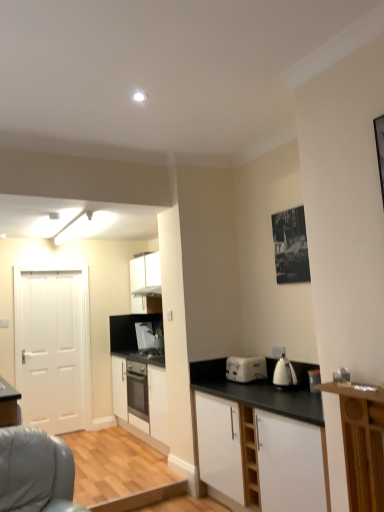
Question: From the image's perspective, relative to white matte cabinet at center, acting as the 3th cabinetry starting from the front, is white glossy electric kettle at right, which appears as the 3th kitchen appliance when viewed from the back, above or below?

Choices:
 (A) below
 (B) above

Answer: (B)

Question: Is white glossy electric kettle at right, positioned as the first kitchen appliance in right-to-left order, taller or shorter than white matte cabinet at center, acting as the 3th cabinetry starting from the front?

Choices:
 (A) tall
 (B) short

Answer: (B)

Question: Based on their relative distances, which object is farther from the matte black microwave at center, the third kitchen appliance when ordered from right to left?

Choices:
 (A) white plastic toaster at center, positioned as the 2th kitchen appliance in right-to-left order
 (B) white plastic toaster at center
 (C) white matte cabinet at center, the 2th cabinetry positioned from the front
 (D) black matte sink at center
 (E) white matte cabinet at lower right, marked as the 1th cabinetry in a front-to-back arrangement

Answer: (B)

Question: Based on their relative distances, which object is farther from the white matte cabinet at center, acting as the 3th cabinetry starting from the front?

Choices:
 (A) white matte door at left
 (B) white plastic toaster at center, positioned as the 2th kitchen appliance in right-to-left order
 (C) matte black microwave at center, which is the third kitchen appliance from front to back
 (D) white matte cabinet at center, marked as the 2th cabinetry in a back-to-front arrangement
 (E) black paper poster at upper right

Answer: (E)